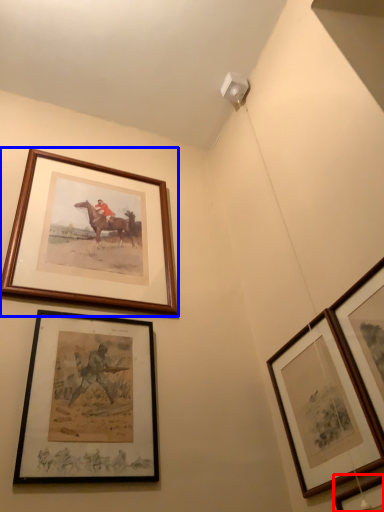
Question: Which point is further to the camera, picture frame (highlighted by a red box) or picture frame (highlighted by a blue box)?

Choices:
 (A) picture frame
 (B) picture frame

Answer: (B)